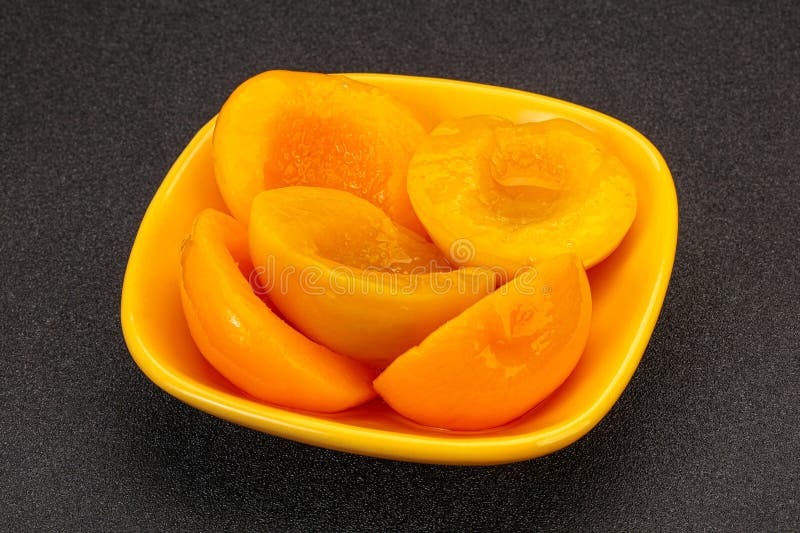
This screenshot has height=533, width=800. Find the location of `half peaches in bowl`. half peaches in bowl is located at coordinates (306, 359), (424, 362), (380, 312), (469, 219), (348, 132).